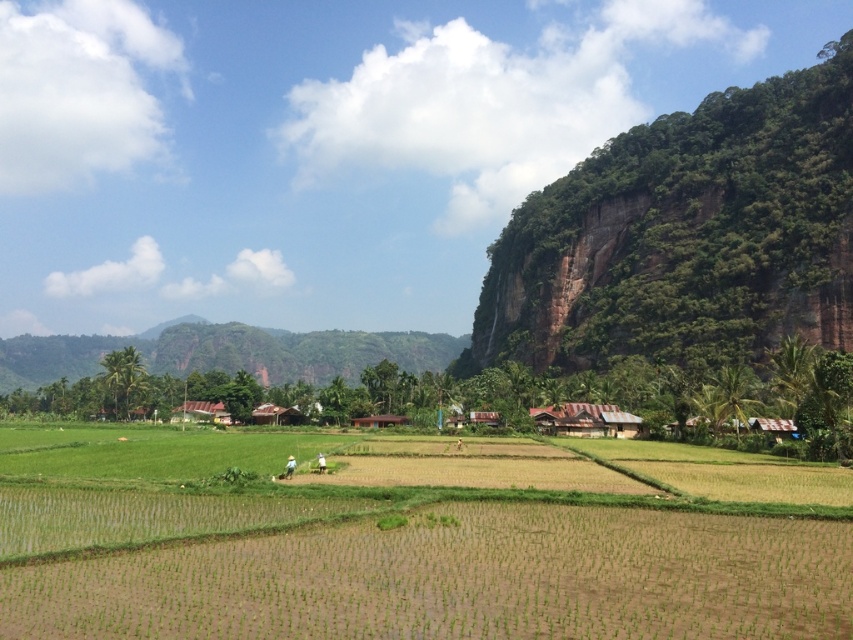
Question: Based on their relative distances, which object is nearer to the green grassy field at center?

Choices:
 (A) green grassy hillside at center
 (B) green textured cliff at upper right

Answer: (B)

Question: Among these objects, which one is nearest to the camera?

Choices:
 (A) green grassy hillside at center
 (B) green textured cliff at upper right

Answer: (B)

Question: In this image, where is green grassy field at center located relative to green textured cliff at upper right?

Choices:
 (A) below
 (B) above

Answer: (A)

Question: Is green grassy field at center positioned at the back of green textured cliff at upper right?

Choices:
 (A) yes
 (B) no

Answer: (B)

Question: Does green grassy field at center have a larger size compared to green grassy hillside at center?

Choices:
 (A) yes
 (B) no

Answer: (B)

Question: Among these objects, which one is nearest to the camera?

Choices:
 (A) green grassy field at center
 (B) green grassy hillside at center

Answer: (A)